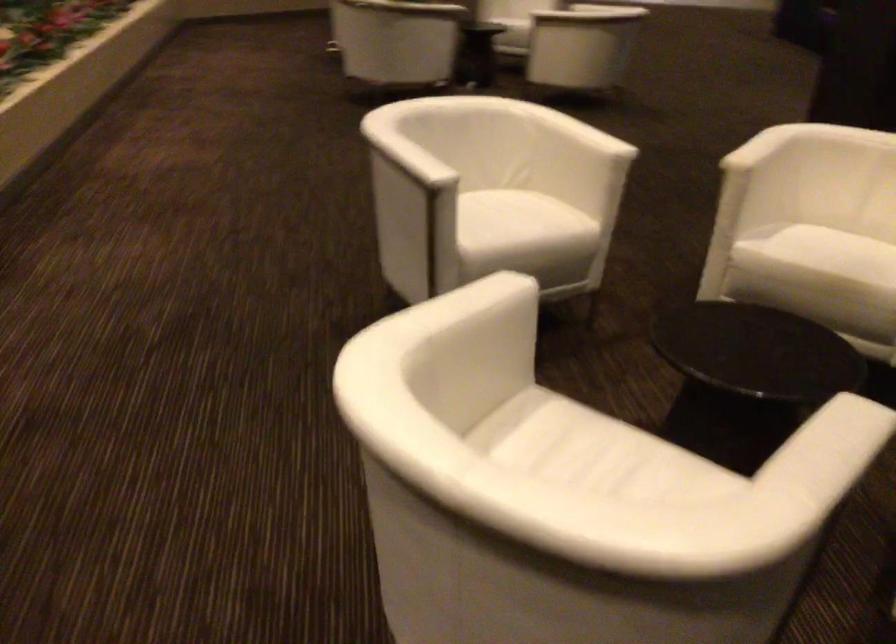
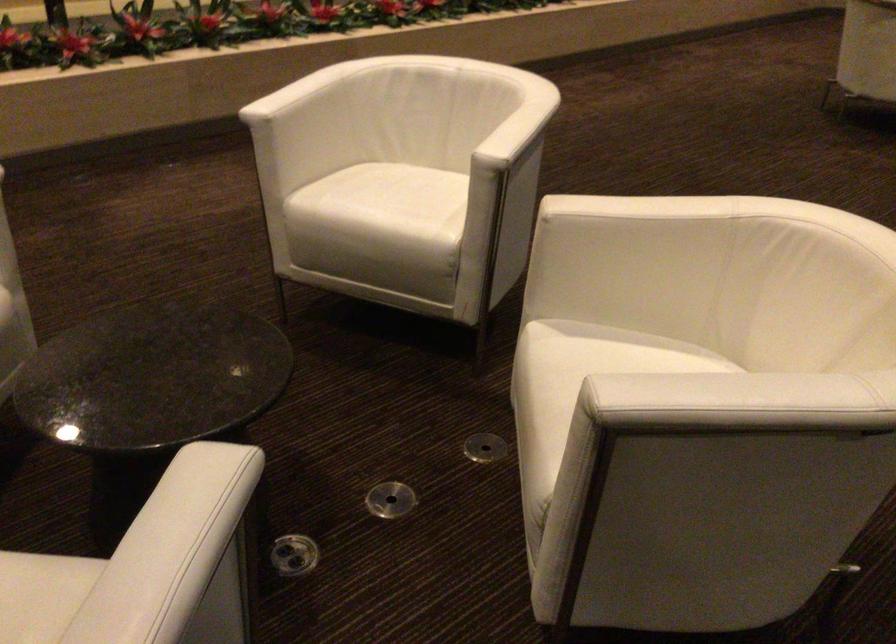
Where in the second image is the point corresponding to [821,242] from the first image?

(581, 366)